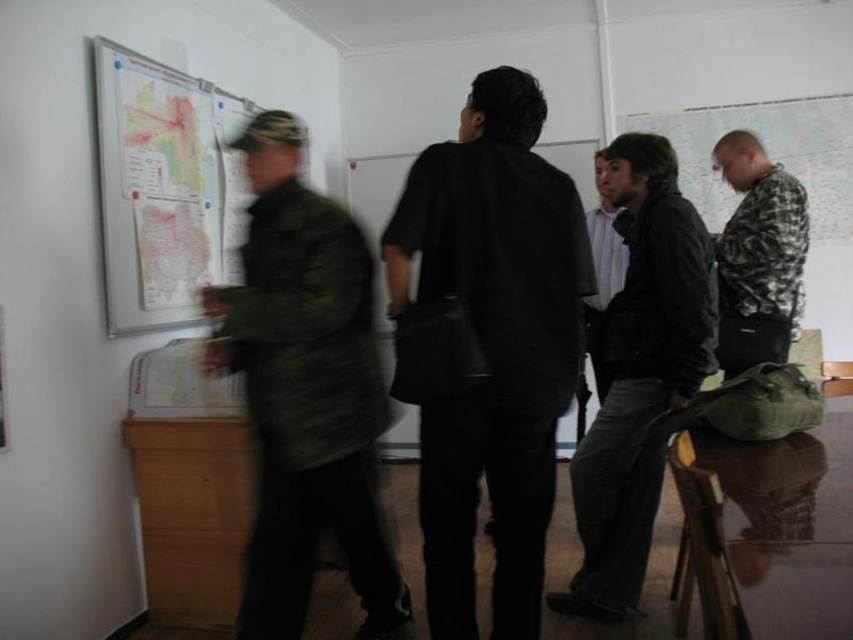
You are a tailor who needs to create a custom jacket for each of the two men in the image. The camouflage jacket at left and the black leather jacket at center. Which jacket requires more fabric based on their widths?

The camouflage jacket at left requires more fabric since its width is larger than the black leather jacket at center.

You are a security guard in the room. You need to identify which person is taller between the camouflage jacket at left and the matte black jacket at center. Which one is taller?

The camouflage jacket at left is much taller than the matte black jacket at center.